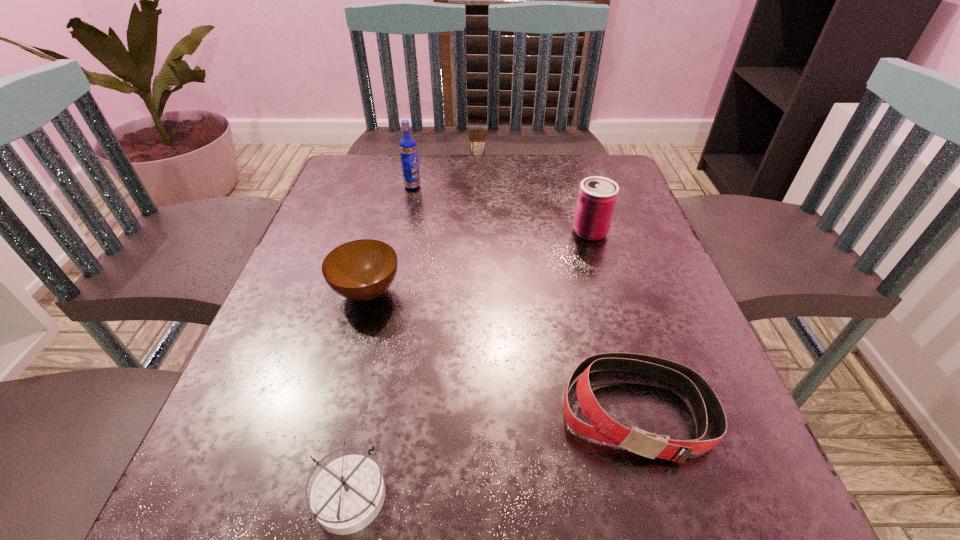
This screenshot has height=540, width=960. What are the coordinates of `empty location between the third nearest object and the dog collar` in the screenshot? It's located at (502, 352).

Locate an element on the screen. The image size is (960, 540). free area in between the compass and the dog collar is located at coordinates (493, 453).

I want to click on free point between the third farthest object and the second farthest object, so click(x=478, y=262).

Select which object is the fourth closest to the compass. Please provide its 2D coordinates. Your answer should be formatted as a tuple, i.e. [(x, y)], where the tuple contains the x and y coordinates of a point satisfying the conditions above.

[(408, 149)]

Identify the location of object that ranks as the third closest to the bowl. The height and width of the screenshot is (540, 960). (408, 149).

At what (x,y) coordinates should I click in order to perform the action: click on vacant area in the image that satisfies the following two spatial constraints: 1. on the front side of the dog collar; 2. on the right side of the third farthest object. Please return your answer as a coordinate pair (x, y). The width and height of the screenshot is (960, 540). Looking at the image, I should click on (335, 411).